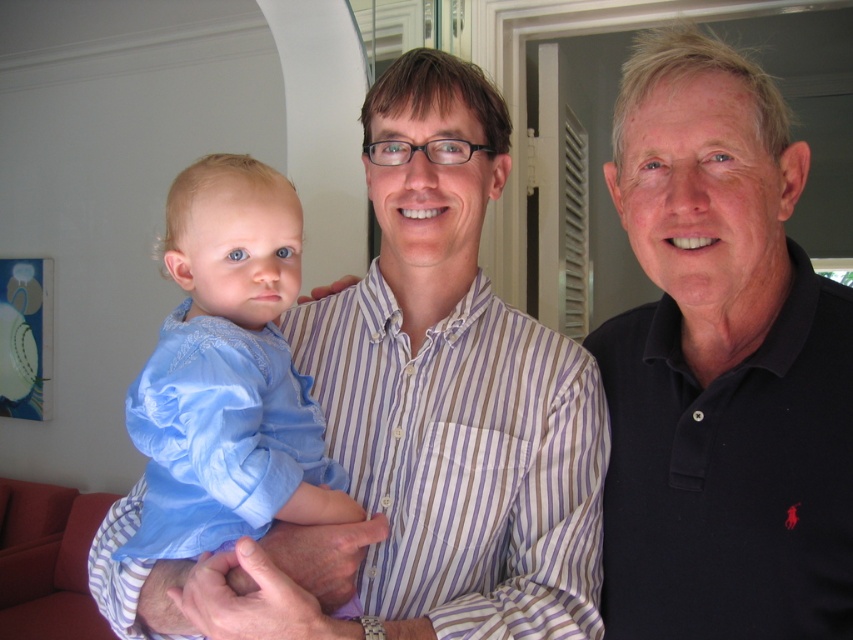
Question: Is dark blue polo shirt at right above silky blue shirt at center?

Choices:
 (A) no
 (B) yes

Answer: (B)

Question: Is dark blue polo shirt at right thinner than silky blue shirt at center?

Choices:
 (A) yes
 (B) no

Answer: (A)

Question: Which of the following is the farthest from the observer?

Choices:
 (A) (202, 410)
 (B) (657, 198)

Answer: (B)

Question: Which point appears closest to the camera in this image?

Choices:
 (A) (807, 476)
 (B) (289, 483)

Answer: (B)

Question: Among these points, which one is farthest from the camera?

Choices:
 (A) (699, 172)
 (B) (251, 435)

Answer: (A)

Question: Does dark blue polo shirt at right have a greater width compared to silky blue shirt at center?

Choices:
 (A) yes
 (B) no

Answer: (B)